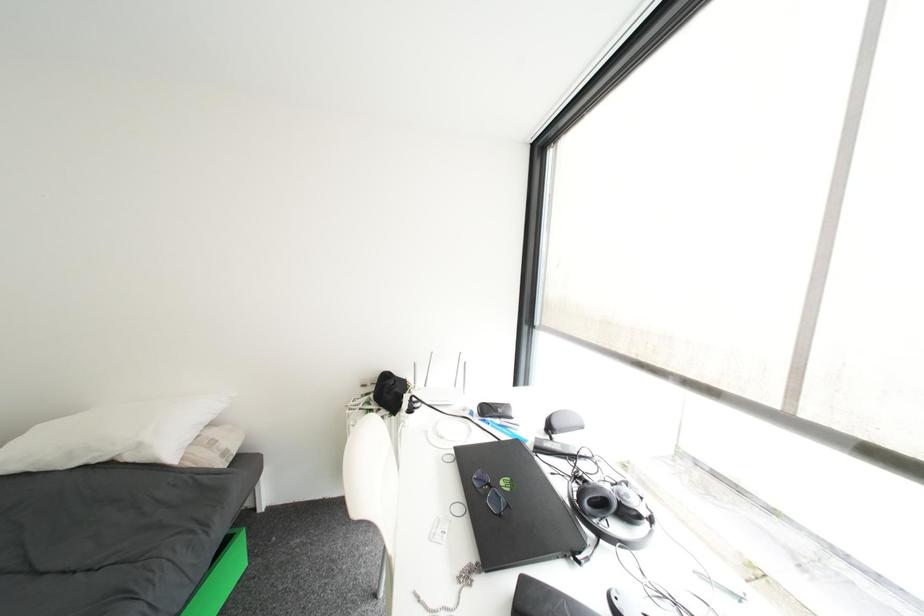
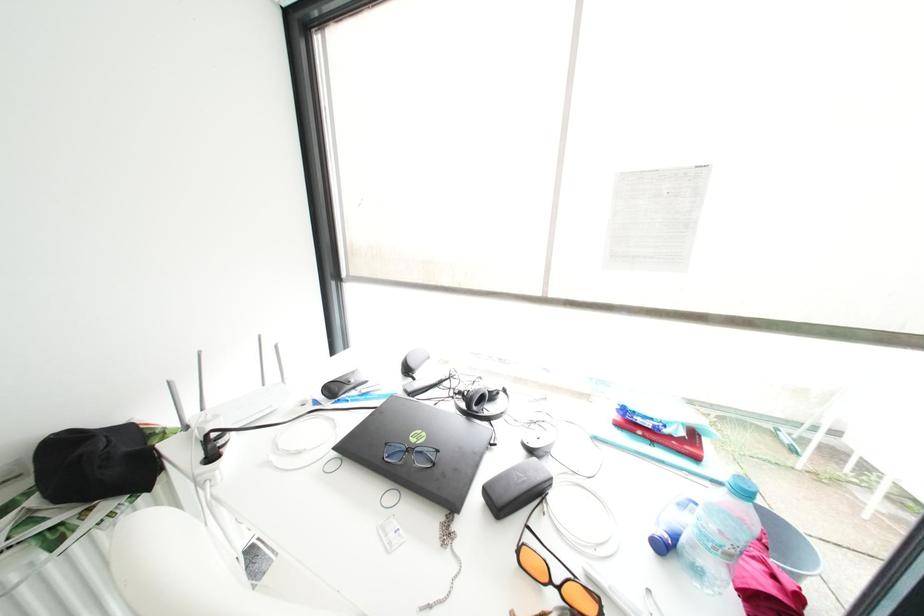
Question: The first image is from the beginning of the video and the second image is from the end. How did the camera likely rotate when shooting the video?

Choices:
 (A) Left
 (B) Right
 (C) Up
 (D) Down

Answer: (B)